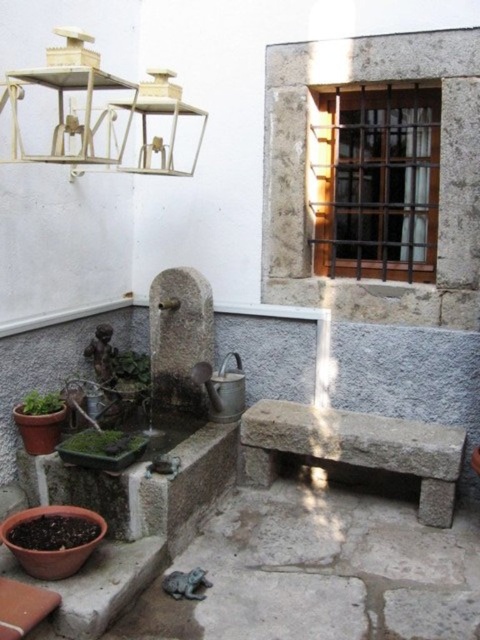
You are standing at the center of the image. Which direction should you move to reach the green leafy plant at lower left?

Since the green leafy plant at lower left is located at point (127, 368), you should move towards the lower left direction to reach it.

You are standing in the outdoor corner and want to water both the green leafy plant at lower center and the green leafy plant at lower left. Which plant should you water first if you want to start from the leftmost position?

The green leafy plant at lower left is the leftmost, so you should water it first.